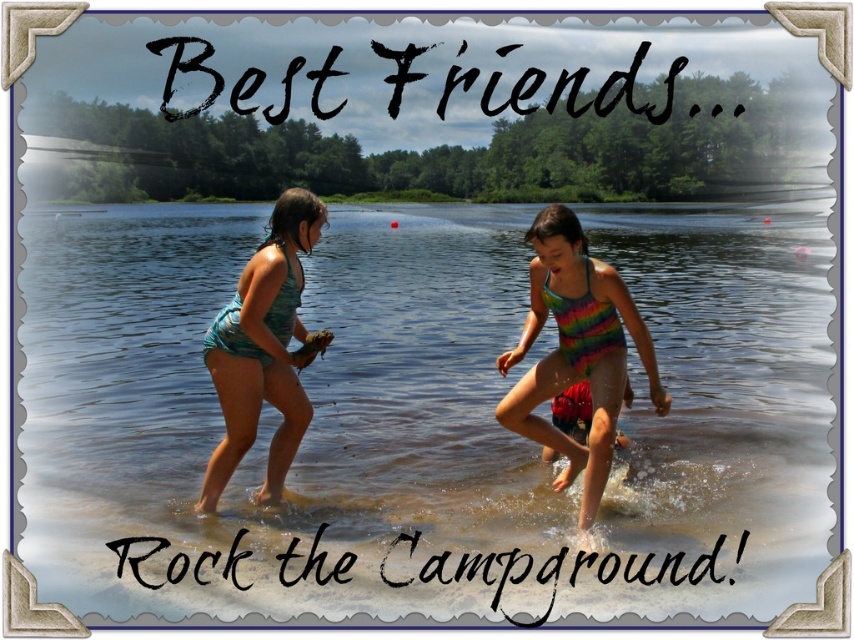
Question: Can you confirm if rainbow striped swimsuit at center is wider than teal fabric swimsuit at left?

Choices:
 (A) yes
 (B) no

Answer: (B)

Question: In this image, where is clear water at center located relative to rainbow striped swimsuit at center?

Choices:
 (A) right
 (B) left

Answer: (B)

Question: Is clear water at center positioned behind teal fabric swimsuit at left?

Choices:
 (A) yes
 (B) no

Answer: (B)

Question: Considering the real-world distances, which object is farthest from the clear water at center?

Choices:
 (A) teal fabric swimsuit at left
 (B) rainbow striped swimsuit at center

Answer: (A)

Question: Which object is farther from the camera taking this photo?

Choices:
 (A) teal fabric swimsuit at left
 (B) clear water at center
 (C) rainbow striped swimsuit at center

Answer: (A)

Question: Which point is farther from the camera taking this photo?

Choices:
 (A) (412, 362)
 (B) (284, 337)

Answer: (A)